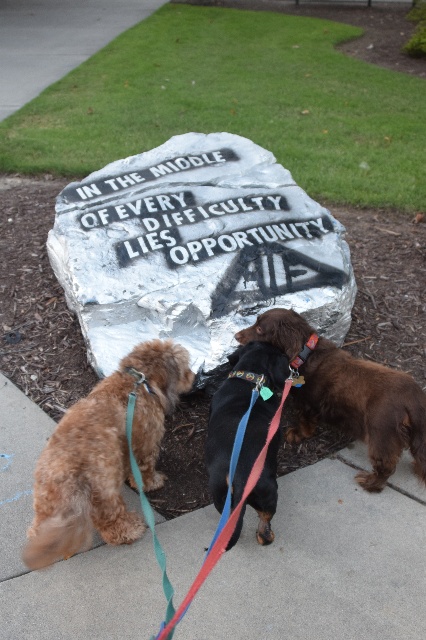
Between smooth concrete pavement at center and golden brown fur at lower left, which one is positioned lower?

Positioned lower is smooth concrete pavement at center.

Can you confirm if smooth concrete pavement at center is taller than golden brown fur at lower left?

No, smooth concrete pavement at center is not taller than golden brown fur at lower left.

At what (x,y) coordinates should I click in order to perform the action: click on smooth concrete pavement at center. Please return your answer as a coordinate pair (x, y). The height and width of the screenshot is (640, 426). Looking at the image, I should click on (322, 564).

The height and width of the screenshot is (640, 426). Identify the location of smooth concrete pavement at center. (322, 564).

Does point (336, 374) come in front of point (92, 26)?

Yes, it is in front of point (92, 26).

Between brown furry dog at center and gray concrete pavement at upper left, which one appears on the left side from the viewer's perspective?

gray concrete pavement at upper left

What are the coordinates of `brown furry dog at center` in the screenshot? It's located at (362, 408).

Does golden brown fur at lower left lie behind gray concrete pavement at upper left?

No.

Does point (63, 541) lie in front of point (51, 29)?

Yes, it is.

Locate an element on the screen. Image resolution: width=426 pixels, height=640 pixels. golden brown fur at lower left is located at coordinates (103, 456).